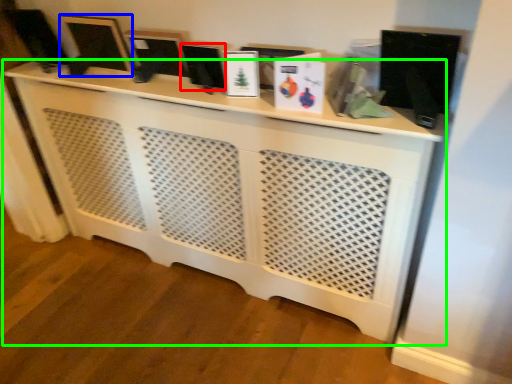
Question: Which object is the farthest from computer monitor (highlighted by a red box)? Choose among these: computer monitor (highlighted by a blue box) or furniture (highlighted by a green box).

Choices:
 (A) computer monitor
 (B) furniture

Answer: (B)